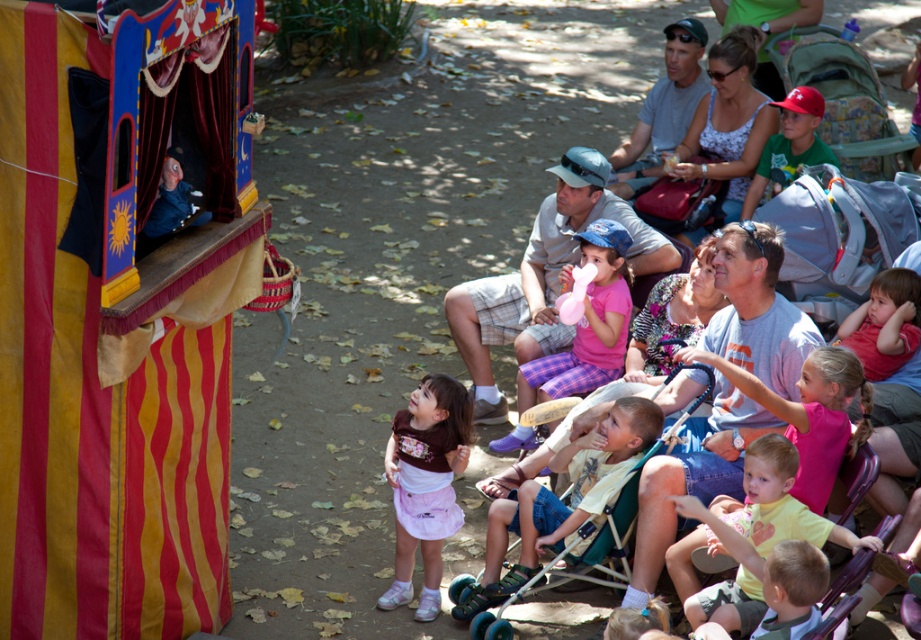
You are standing at the point with coordinates point (395, 550) and want to walk to the point with coordinates point (689, 516). Given the scene described, will you be able to see the puppet theater with red and yellow vertical stripes on its sides while walking towards your destination?

Since point (395, 550) is behind point (689, 516), you will be moving towards the puppet theater with red and yellow vertical stripes on its sides and will have a clear view of it while walking towards your destination.

You are a photographer trying to capture a clear photo of the pink fabric dress at center. The pink fabric hat at center is blocking your view. Can you move around to the side to get a better shot without moving the objects?

The pink fabric hat at center is further to the viewer than the pink fabric dress at center, so moving to the side might allow you to see around the hat to capture the dress.

You are standing at the center of the scene and want to pick up your light yellow sandal at lower center. Which direction should you move to reach it?

The light yellow sandal at lower center is located at point [558,499], so you should move towards the lower center direction to reach it.